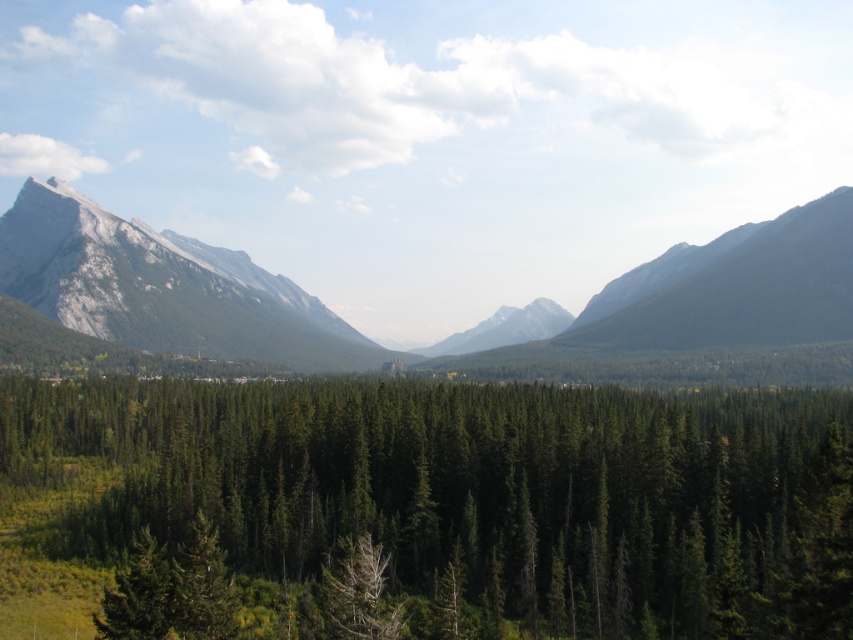
Is dark gray rocky mountain at upper right shorter than green matte tree at center?

No.

Which is behind, point (844, 305) or point (381, 614)?

The point (844, 305) is more distant.

At what (x,y) coordinates should I click in order to perform the action: click on dark gray rocky mountain at upper right. Please return your answer as a coordinate pair (x, y). The height and width of the screenshot is (640, 853). Looking at the image, I should click on (749, 291).

Who is more distant from viewer, (830, 294) or (599, 344)?

The point (599, 344) is more distant.

This screenshot has height=640, width=853. What do you see at coordinates (466, 353) in the screenshot?
I see `rugged granite mountain range at left` at bounding box center [466, 353].

What do you see at coordinates (466, 353) in the screenshot? I see `rugged granite mountain range at left` at bounding box center [466, 353].

This screenshot has height=640, width=853. I want to click on rugged granite mountain range at left, so click(x=466, y=353).

Is rugged granite mountain range at left smaller than rugged stone mountain at left?

Incorrect, rugged granite mountain range at left is not smaller in size than rugged stone mountain at left.

Between rugged granite mountain range at left and rugged stone mountain at left, which one has more height?

With more height is rugged stone mountain at left.

Is point (734, 280) closer to viewer compared to point (293, 365)?

Yes, point (734, 280) is closer to viewer.

Identify the location of rugged granite mountain range at left. (466, 353).